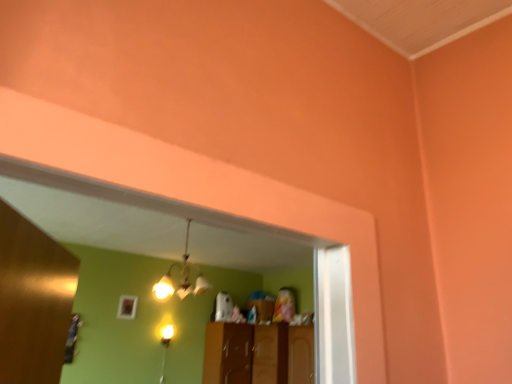
Question: In terms of height, does matte brass chandelier at center look taller or shorter compared to brown wood cabinet at center?

Choices:
 (A) short
 (B) tall

Answer: (A)

Question: Looking at their shapes, would you say matte brass chandelier at center is wider or thinner than brown wood cabinet at center?

Choices:
 (A) wide
 (B) thin

Answer: (B)

Question: Is point (183, 264) closer or farther from the camera than point (215, 377)?

Choices:
 (A) farther
 (B) closer

Answer: (B)

Question: Considering their positions, is brown wood cabinet at center located in front of or behind matte brass chandelier at center?

Choices:
 (A) behind
 (B) front

Answer: (A)

Question: From their relative heights in the image, would you say brown wood cabinet at center is taller or shorter than matte brass chandelier at center?

Choices:
 (A) short
 (B) tall

Answer: (B)

Question: From the image's perspective, is brown wood cabinet at center located above or below matte brass chandelier at center?

Choices:
 (A) above
 (B) below

Answer: (B)

Question: Is point (236, 344) positioned closer to the camera than point (188, 279)?

Choices:
 (A) closer
 (B) farther

Answer: (B)